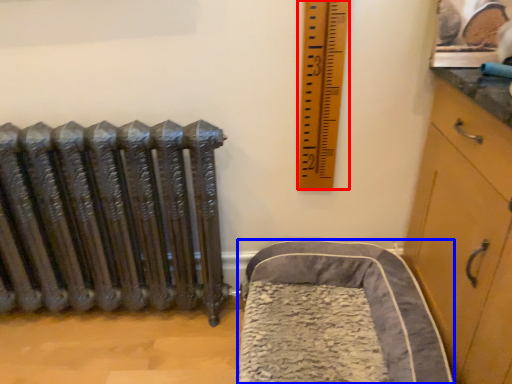
Question: Which object appears farthest to the camera in this image, ruler (highlighted by a red box) or furniture (highlighted by a blue box)?

Choices:
 (A) ruler
 (B) furniture

Answer: (A)